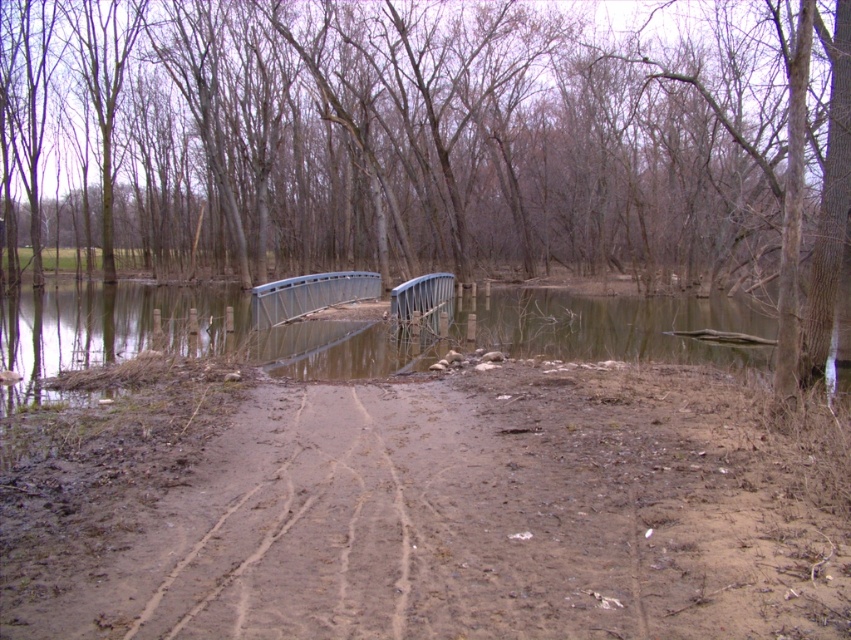
Does point (43, 204) come closer to viewer compared to point (312, 284)?

No, it is behind (312, 284).

The width and height of the screenshot is (851, 640). Find the location of `brown wood tree at center`. brown wood tree at center is located at coordinates (420, 161).

The image size is (851, 640). Describe the element at coordinates (420, 161) in the screenshot. I see `brown wood tree at center` at that location.

What are the coordinates of `brown wood tree at center` in the screenshot? It's located at (420, 161).

Based on the photo, is brown wood tree at center above brown muddy dirt track at center?

Indeed, brown wood tree at center is positioned over brown muddy dirt track at center.

Which is above, brown wood tree at center or brown muddy dirt track at center?

brown wood tree at center

Who is more distant from viewer, (283, 42) or (129, 525)?

Point (283, 42)

At what (x,y) coordinates should I click in order to perform the action: click on brown wood tree at center. Please return your answer as a coordinate pair (x, y). Image resolution: width=851 pixels, height=640 pixels. Looking at the image, I should click on (420, 161).

Does brown muddy dirt track at center have a greater width compared to metallic gray bridge at center?

Correct, the width of brown muddy dirt track at center exceeds that of metallic gray bridge at center.

Between point (488, 589) and point (374, 289), which one is positioned behind?

The point (374, 289) is behind.

In the scene shown: Who is more distant from viewer, (136, 403) or (413, 304)?

Point (413, 304)

Identify the location of brown muddy dirt track at center. (427, 509).